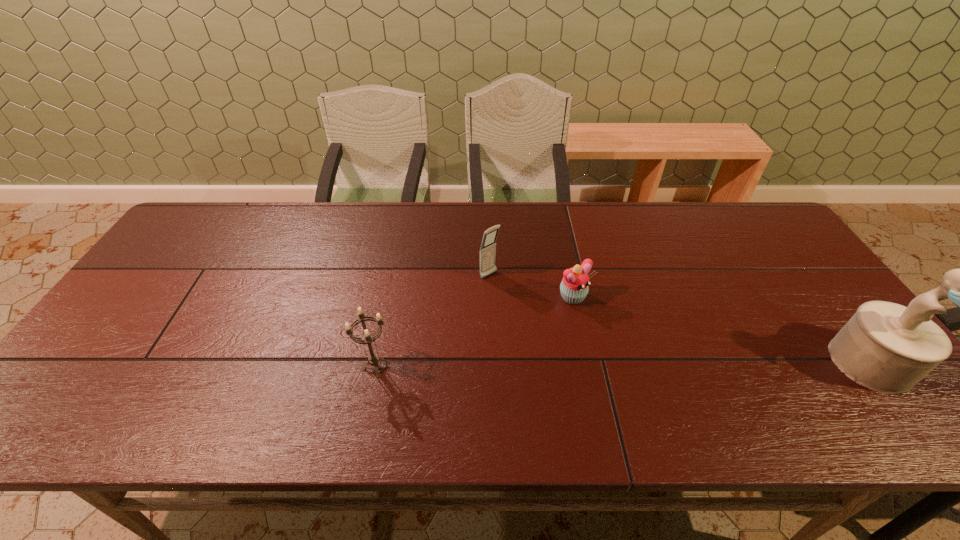
Find the location of `vacant space on the desktop that is between the leftmost object and the figurine and is positioned on the face of the shortest object`. vacant space on the desktop that is between the leftmost object and the figurine and is positioned on the face of the shortest object is located at coordinates (645, 364).

What are the coordinates of `vacant space on the desktop that is between the leftmost object and the tallest object and is positioned on the front-facing side of the second object from left to right` in the screenshot? It's located at (588, 364).